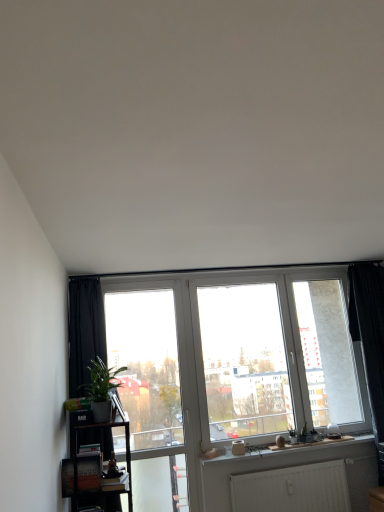
Question: Does point (94, 372) appear closer or farther from the camera than point (374, 376)?

Choices:
 (A) closer
 (B) farther

Answer: (A)

Question: Looking at their shapes, would you say green leafy plant at left is wider or thinner than black fabric curtain at right?

Choices:
 (A) wide
 (B) thin

Answer: (B)

Question: Which is farther from the transparent glass screen door at center?

Choices:
 (A) black fabric curtain at right
 (B) green leafy plant at left
 (C) black wooden shelf at lower left

Answer: (A)

Question: Which object is the closest to the black wooden shelf at lower left?

Choices:
 (A) green leafy plant at left
 (B) transparent glass screen door at center
 (C) black fabric curtain at right

Answer: (A)